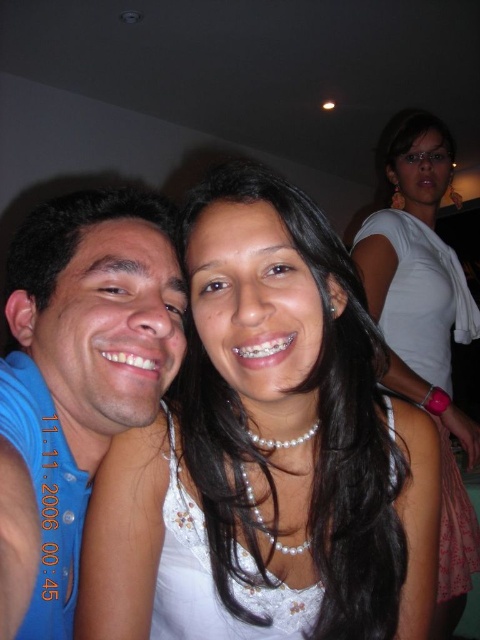
In the scene shown: What are the coordinates of the blue cotton shirt at left in the image?

The blue cotton shirt at left is located at coordinates point [84,360].

You are taking a photo of the blue cotton shirt at left and the white pearl necklace at upper center. Which object will appear larger in the photo?

The blue cotton shirt at left appears larger in the photo because it is closer to the viewer than the white pearl necklace at upper center.

You are a photographer adjusting the focus of your camera. You need to ensure both the blue cotton shirt at left and the white pearl necklace at upper center are in focus. Which object should you focus on first to ensure the other is also in focus?

The blue cotton shirt at left is shorter than the white pearl necklace at upper center. To ensure both are in focus, you should focus on the white pearl necklace at upper center first since it is farther away, allowing the depth of field to cover the closer blue cotton shirt at left.